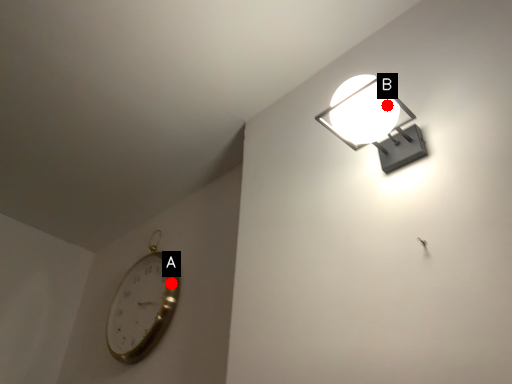
Question: Two points are circled on the image, labeled by A and B beside each circle. Among these points, which one is nearest to the camera?

Choices:
 (A) A is closer
 (B) B is closer

Answer: (B)